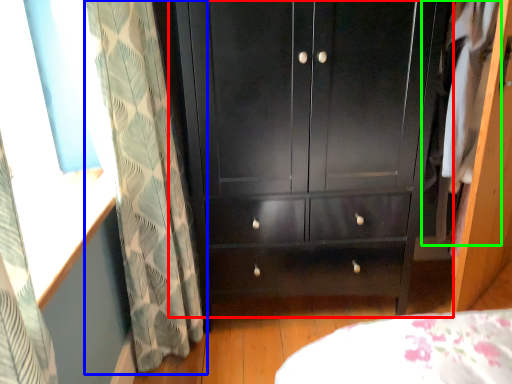
Question: Considering the real-world distances, which object is closest to cupboard (highlighted by a red box)? curtain (highlighted by a blue box) or clothing (highlighted by a green box).

Choices:
 (A) curtain
 (B) clothing

Answer: (A)